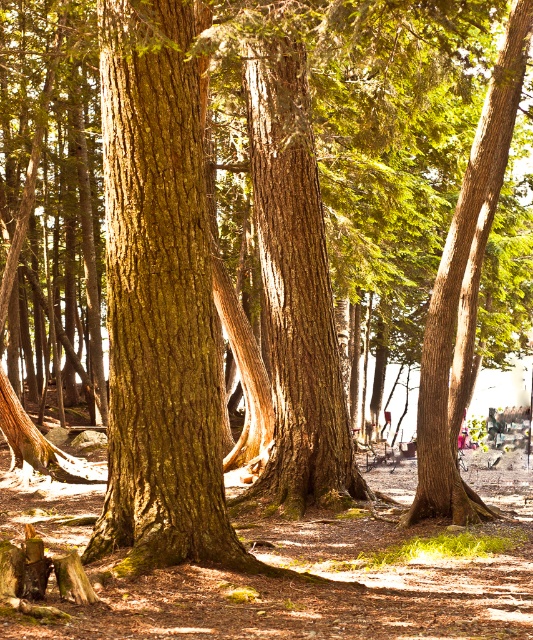
You are a nature photographer standing in the middle of the forest. You want to take a photo of both the brown rough bark tree trunk at center and the brown rough tree trunk at center. Which tree trunk will appear larger in your photo?

The brown rough bark tree trunk at center will appear larger in the photo because it is bigger than the brown rough tree trunk at center according to the description.

You are a hiker carrying a 3.5 meter long ladder. You need to place it between the brown rough bark tree trunk at center and the brown rough tree trunk at center. Will the ladder fit between them?

The distance between the brown rough bark tree trunk at center and the brown rough tree trunk at center is 4.01 meters, so the 3.5 meter ladder will fit between them since it is shorter than the gap.